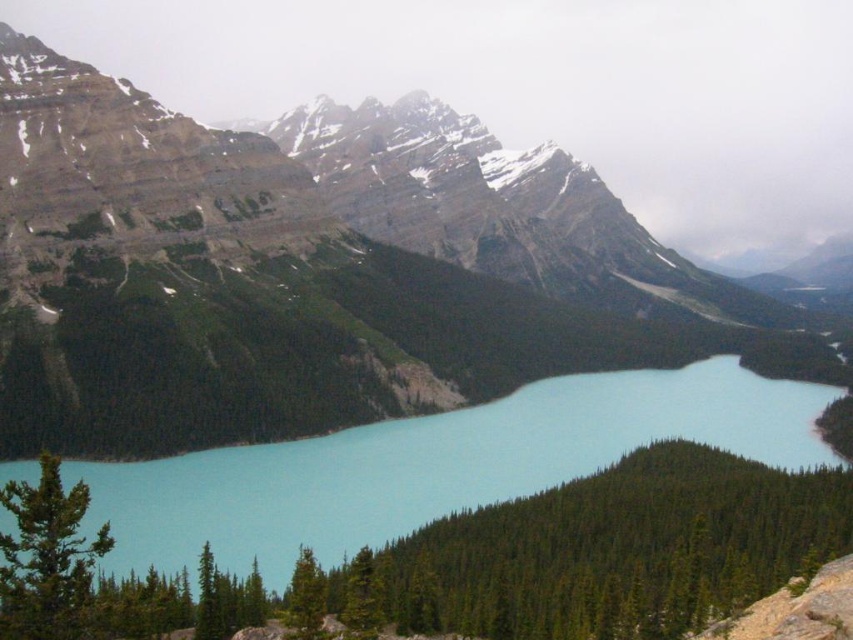
Question: Is rocky mountain at upper left thinner than turquoise water at center?

Choices:
 (A) yes
 (B) no

Answer: (B)

Question: In this image, where is rocky mountain at upper left located relative to turquoise water at center?

Choices:
 (A) below
 (B) above

Answer: (B)

Question: Which of the following is the closest to the observer?

Choices:
 (A) (532, 440)
 (B) (453, 214)

Answer: (A)

Question: Does rocky mountain at upper left appear under turquoise water at center?

Choices:
 (A) yes
 (B) no

Answer: (B)